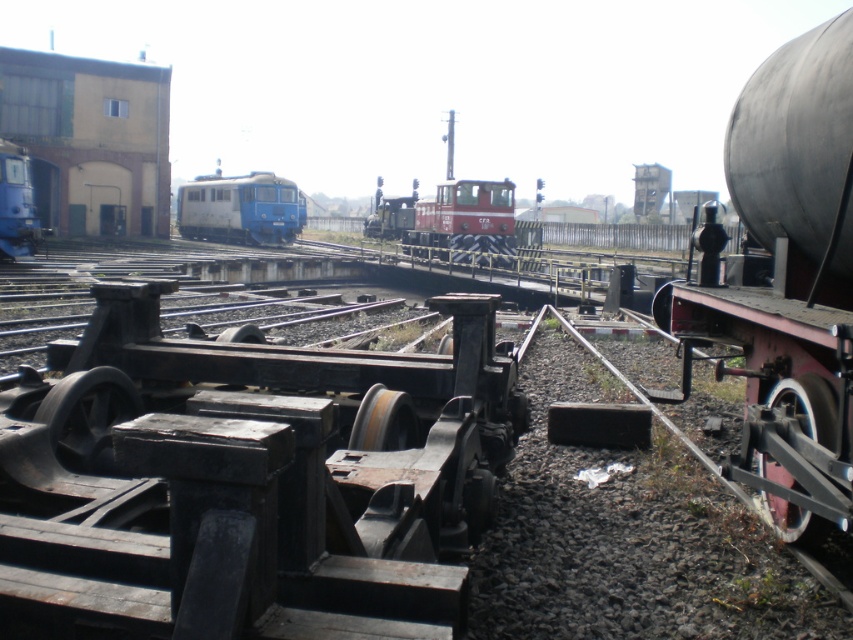
Question: Does red matte train at center appear over brushed metal locomotive at left?

Choices:
 (A) no
 (B) yes

Answer: (B)

Question: From the image, what is the correct spatial relationship of red matte train at center in relation to blue matte train at center?

Choices:
 (A) above
 (B) below

Answer: (B)

Question: Can you confirm if smooth black tank car at right is thinner than brushed metal locomotive at left?

Choices:
 (A) no
 (B) yes

Answer: (B)

Question: Which of the following is the closest to the observer?

Choices:
 (A) smooth black tank car at right
 (B) blue matte train at center
 (C) red matte train at center
 (D) brushed metal locomotive at left

Answer: (A)

Question: Which object is the closest to the blue matte train at center?

Choices:
 (A) smooth black tank car at right
 (B) red matte train at center
 (C) brushed metal locomotive at left

Answer: (B)

Question: Based on their relative distances, which object is nearer to the smooth black tank car at right?

Choices:
 (A) brushed metal locomotive at left
 (B) blue matte train at center

Answer: (A)